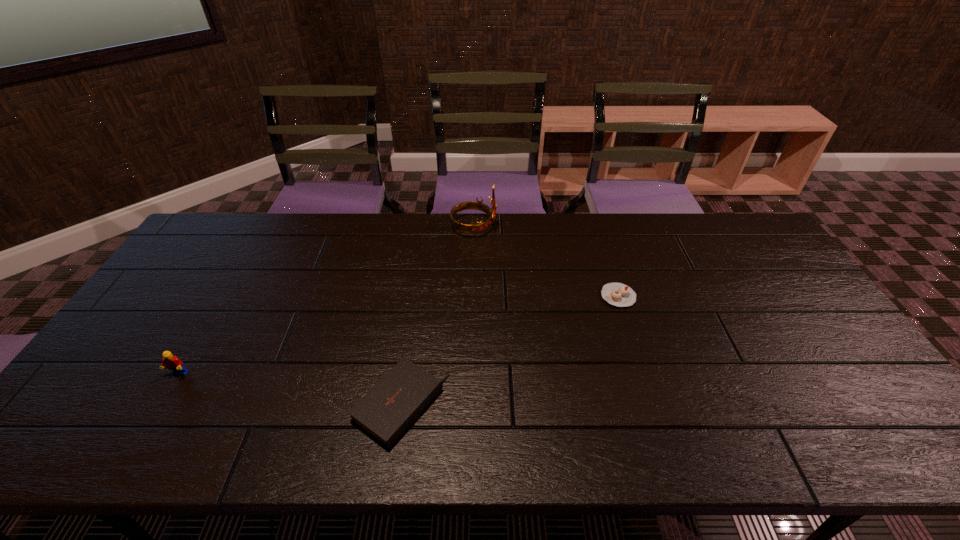
This screenshot has width=960, height=540. What are the coordinates of `object that ranks as the closest to the Lego` in the screenshot? It's located at (385, 412).

I want to click on the third closest object to the Bible, so click(480, 226).

Identify the location of free space that satisfies the following two spatial constraints: 1. on the front-facing side of the tiara; 2. on the back side of the cupcake. (472, 296).

Find the location of a particular element. The width and height of the screenshot is (960, 540). free spot that satisfies the following two spatial constraints: 1. on the front-facing side of the farthest object; 2. on the back side of the cupcake is located at coordinates (472, 296).

This screenshot has height=540, width=960. What are the coordinates of `vacant region that satisfies the following two spatial constraints: 1. on the front-facing side of the farthest object; 2. on the left side of the cupcake` in the screenshot? It's located at (472, 296).

Identify the location of blank area in the image that satisfies the following two spatial constraints: 1. on the front-facing side of the tiara; 2. on the front side of the Bible. (470, 405).

Where is `free region that satisfies the following two spatial constraints: 1. on the front-facing side of the tallest object; 2. on the back side of the cupcake`? free region that satisfies the following two spatial constraints: 1. on the front-facing side of the tallest object; 2. on the back side of the cupcake is located at coordinates (472, 296).

What are the coordinates of `vacant space that satisfies the following two spatial constraints: 1. on the front-facing side of the Bible; 2. on the left side of the Lego` in the screenshot? It's located at [160, 405].

Locate an element on the screen. This screenshot has width=960, height=540. blank area in the image that satisfies the following two spatial constraints: 1. on the front-facing side of the tiara; 2. on the back side of the cupcake is located at coordinates (472, 296).

You are a GUI agent. You are given a task and a screenshot of the screen. Output one action in this format:
    pyautogui.click(x=<x>, y=<y>)
    Task: Click on the vacant space that satisfies the following two spatial constraints: 1. on the front-facing side of the Bible; 2. on the left side of the Lego
    This screenshot has height=540, width=960.
    Given the screenshot: What is the action you would take?
    pyautogui.click(x=160, y=405)